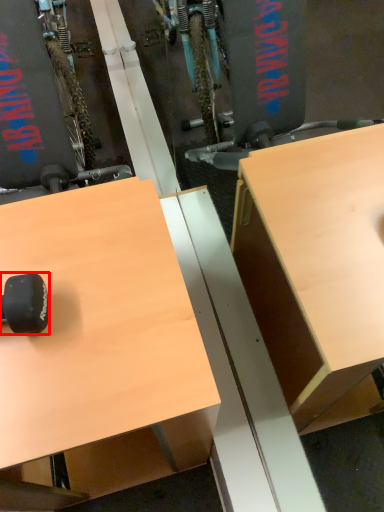
Question: Observing the image, what is the correct spatial positioning of wheel (annotated by the red box) in reference to desk?

Choices:
 (A) right
 (B) left

Answer: (B)